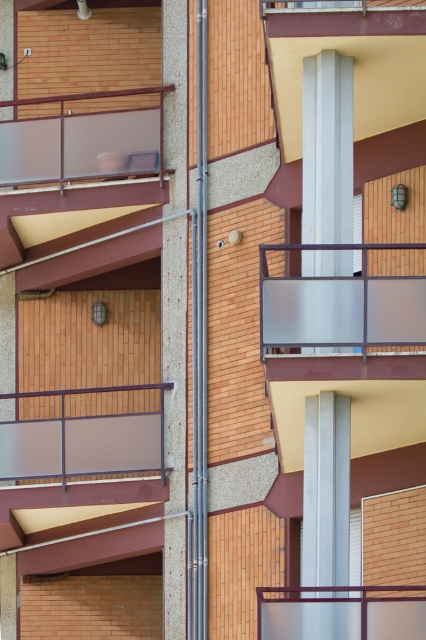
You are an architect designing a new residential building. You need to decide where to place a new plant stand that requires 1.2 meters of space. Which balcony between the matte gray glass balcony at center and the clear glass balcony at upper center would be more suitable for the plant stand?

The clear glass balcony at upper center has a greater width than the matte gray glass balcony at center, so it would be more suitable for placing the plant stand requiring 1.2 meters of space.

You are standing in front of the residential building and want to locate the matte gray glass balcony at center. What are the coordinates where you can find it?

The matte gray glass balcony at center can be found at coordinates point (83, 440).

You are standing on the ground floor of the building and looking up at the frosted glass balcony at center and the clear glass balcony at upper center. Which balcony is closer to you?

The frosted glass balcony at center is closer to you since it is only 20.92 feet away from the clear glass balcony at upper center, meaning it is positioned lower and nearer to the ground floor.